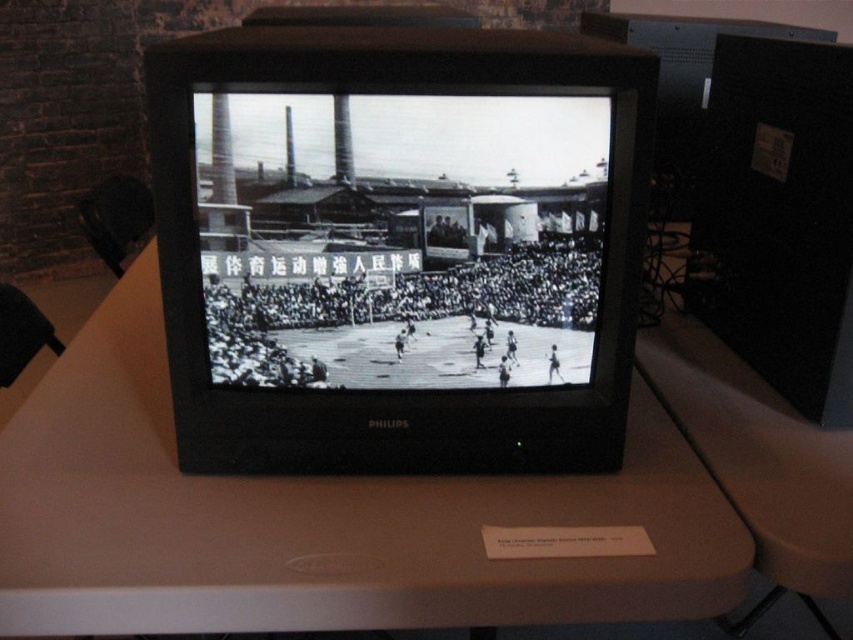
Can you confirm if white matte table at center is taller than black and white basketball court at center?

Yes.

Does point (346, 516) come behind point (287, 368)?

That is False.

Locate an element on the screen. This screenshot has width=853, height=640. white matte table at center is located at coordinates (317, 518).